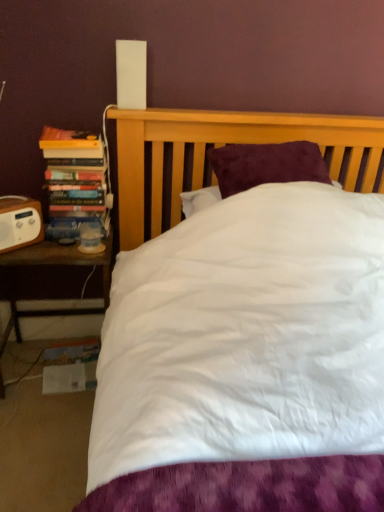
Question: From a real-world perspective, is brown wooden nightstand at left below hardcover books at left?

Choices:
 (A) no
 (B) yes

Answer: (B)

Question: Considering the relative sizes of brown wooden nightstand at left and hardcover books at left in the image provided, is brown wooden nightstand at left wider than hardcover books at left?

Choices:
 (A) yes
 (B) no

Answer: (A)

Question: Would you consider brown wooden nightstand at left to be distant from hardcover books at left?

Choices:
 (A) no
 (B) yes

Answer: (A)

Question: Does brown wooden nightstand at left turn towards hardcover books at left?

Choices:
 (A) yes
 (B) no

Answer: (B)

Question: Does brown wooden nightstand at left have a greater height compared to hardcover books at left?

Choices:
 (A) no
 (B) yes

Answer: (B)

Question: From the image's perspective, is white plastic speaker at left positioned above or below hardcover books at left?

Choices:
 (A) above
 (B) below

Answer: (B)

Question: Considering the positions of white plastic speaker at left and hardcover books at left in the image, is white plastic speaker at left wider or thinner than hardcover books at left?

Choices:
 (A) thin
 (B) wide

Answer: (A)

Question: Is white plastic speaker at left bigger or smaller than hardcover books at left?

Choices:
 (A) small
 (B) big

Answer: (A)

Question: Choose the correct answer: Is white plastic speaker at left inside hardcover books at left or outside it?

Choices:
 (A) inside
 (B) outside

Answer: (B)

Question: Choose the correct answer: Is white plastic speaker at left inside brown wooden nightstand at left or outside it?

Choices:
 (A) inside
 (B) outside

Answer: (B)

Question: From the image's perspective, is white plastic speaker at left located above or below brown wooden nightstand at left?

Choices:
 (A) below
 (B) above

Answer: (B)

Question: From a real-world perspective, is white plastic speaker at left positioned above or below brown wooden nightstand at left?

Choices:
 (A) below
 (B) above

Answer: (B)

Question: Is white plastic speaker at left to the left or to the right of brown wooden nightstand at left in the image?

Choices:
 (A) right
 (B) left

Answer: (B)

Question: From the image's perspective, is brown wooden nightstand at left located above or below white plastic speaker at left?

Choices:
 (A) below
 (B) above

Answer: (A)

Question: Would you say brown wooden nightstand at left is inside or outside white plastic speaker at left?

Choices:
 (A) inside
 (B) outside

Answer: (B)